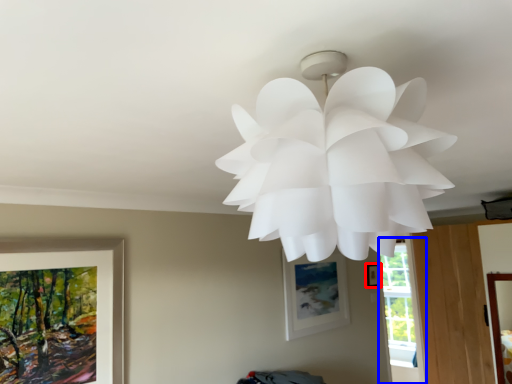
Question: Which point is closer to the camera, picture frame (highlighted by a red box) or window (highlighted by a blue box)?

Choices:
 (A) picture frame
 (B) window

Answer: (A)